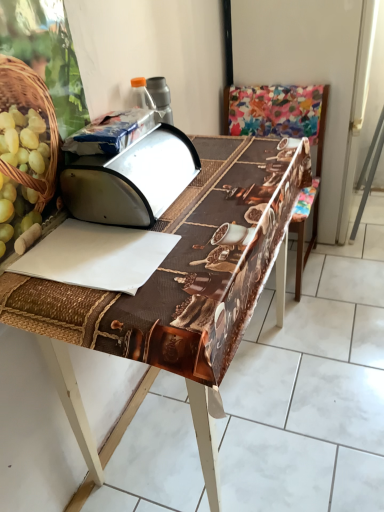
The width and height of the screenshot is (384, 512). Identify the location of vacant space in front of metallic silver breadbox at center. (139, 249).